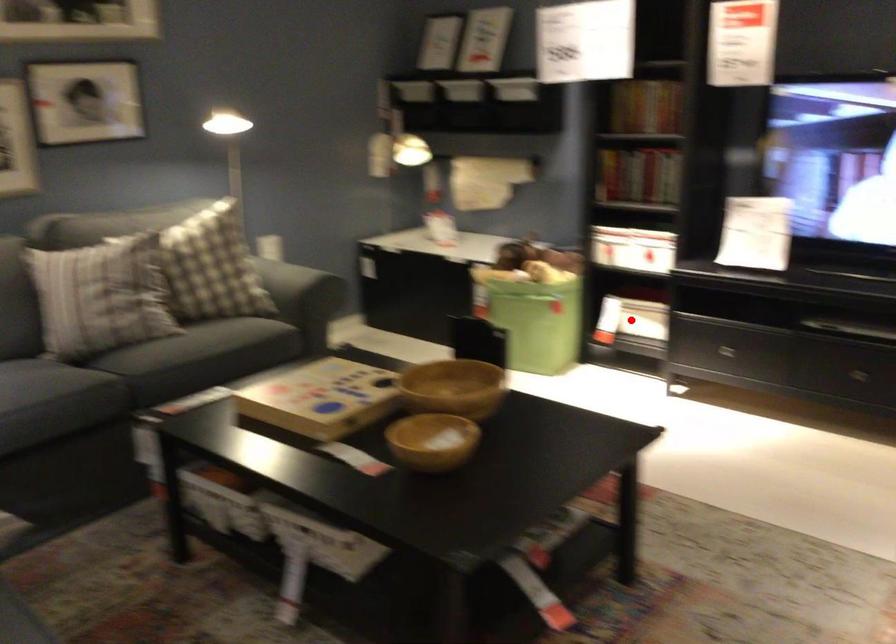
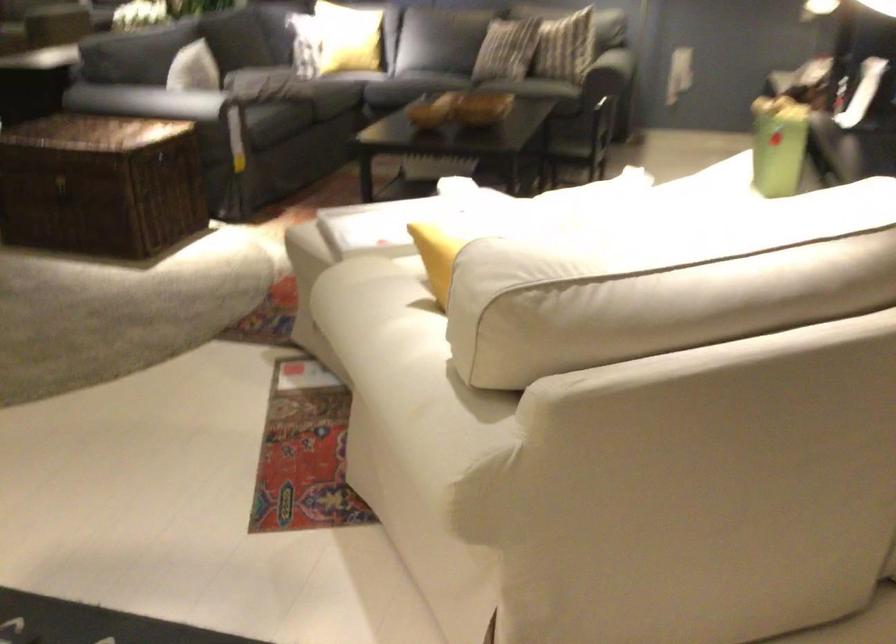
Question: I am providing you with two images of the same scene from different viewpoints. A red point is marked on the first image. At the location where the point appears in image 1, is it still visible in image 2?

Choices:
 (A) Yes
 (B) No

Answer: (B)